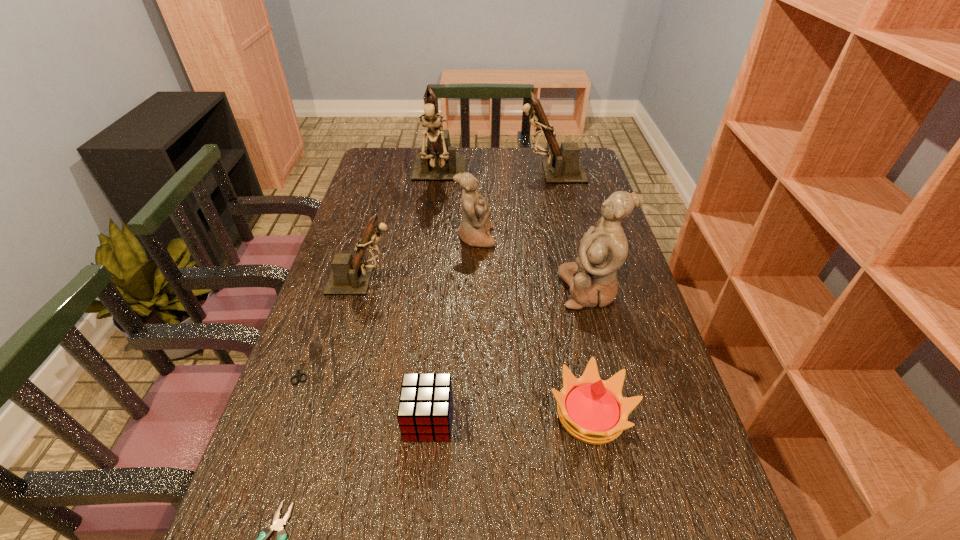
Find the location of a particular element. The height and width of the screenshot is (540, 960). vacant space at the left edge is located at coordinates (376, 185).

The width and height of the screenshot is (960, 540). I want to click on free point at the right edge, so click(x=626, y=331).

Identify the location of free space at the far left corner. The height and width of the screenshot is (540, 960). (396, 165).

You are a GUI agent. You are given a task and a screenshot of the screen. Output one action in this format:
    pyautogui.click(x=<x>, y=<y>)
    Task: Click on the free space at the far right corner of the desktop
    The height and width of the screenshot is (540, 960).
    Given the screenshot: What is the action you would take?
    [592, 167]

This screenshot has height=540, width=960. In order to click on free space between the right white figurine and the cube in this screenshot , I will do 509,355.

The width and height of the screenshot is (960, 540). I want to click on free space between the crown and the nearest brown figurine, so click(476, 347).

I want to click on empty location between the second smallest brown figurine and the right white figurine, so click(x=570, y=231).

Where is `free space that is in between the nearest brown figurine and the crown`? Image resolution: width=960 pixels, height=540 pixels. free space that is in between the nearest brown figurine and the crown is located at coordinates (476, 347).

The height and width of the screenshot is (540, 960). I want to click on free area in between the shortest object and the smaller white figurine, so click(388, 302).

You are a GUI agent. You are given a task and a screenshot of the screen. Output one action in this format:
    pyautogui.click(x=<x>, y=<y>)
    Task: Click on the unoccupied position between the right white figurine and the black shears
    
    Given the screenshot: What is the action you would take?
    pyautogui.click(x=445, y=328)